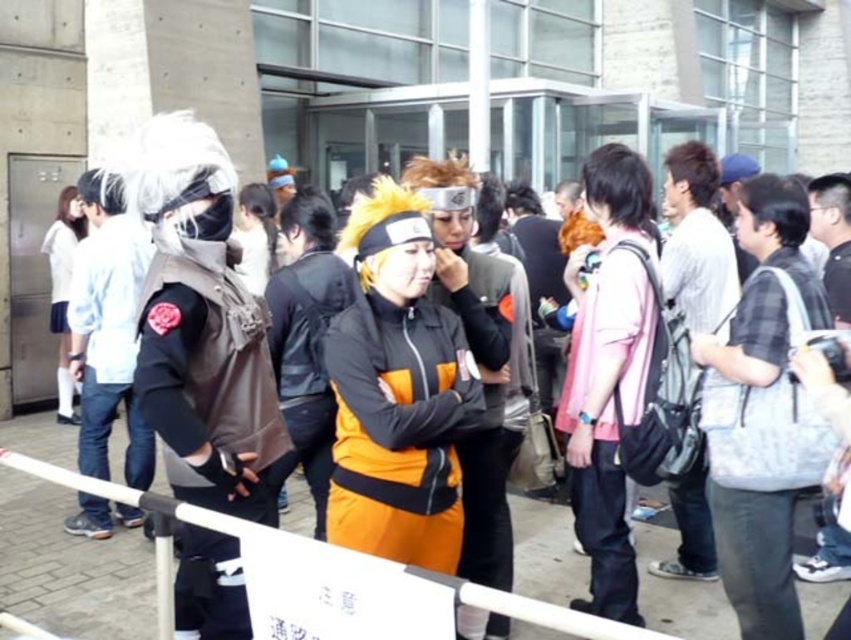
You are a photographer at the event and want to capture both the matte black vest at center and the white matte jacket at left in a single shot. Which one is positioned closer to you?

The matte black vest at center is closer to the viewer than the white matte jacket at left, so it will appear larger in the photo.

Consider the image. You are a photographer at the event and want to capture both the matte black vest at center and the white matte jacket at left in a single frame. Based on their positions, which object should you adjust your camera to focus on first to ensure both are in the shot?

You should focus on the white matte jacket at left first since the matte black vest at center is to the right of it, ensuring both are within the frame by centering on the jacket and adjusting towards the vest.

In the scene shown: You are a photographer trying to capture a photo of the pink fabric shirt at center and the white plastic barrier at center. Which object should you adjust your camera focus to first if you want to ensure both are in focus, considering their positions?

The white plastic barrier at center is positioned on the left side of pink fabric shirt at center, so you should focus on the white plastic barrier at center first as it is closer to the camera.